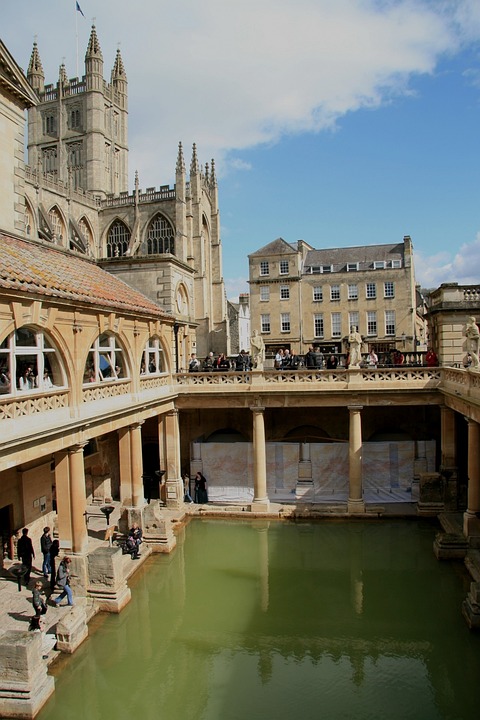
Identify the location of archway. This screenshot has width=480, height=720. (159, 212).